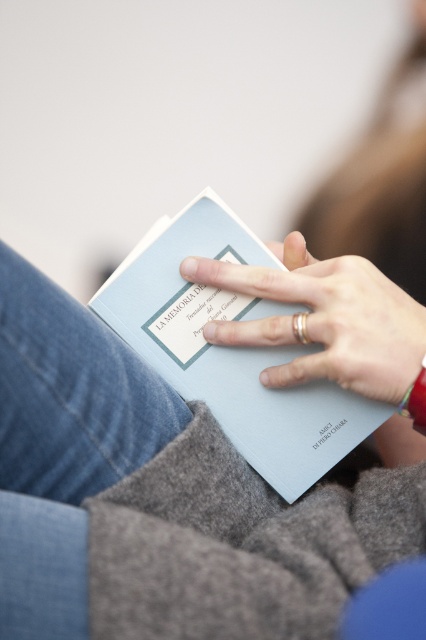
You are a photographer trying to capture the book cover clearly. Since the light blue matte paper at center and the smooth skin hand at center are in focus, which object should you adjust to ensure the book cover remains sharp when moving the camera slightly?

The light blue matte paper at center is larger in size than the smooth skin hand at center, so adjusting the light blue matte paper at center would be more effective to keep the book cover sharp as it has a larger surface area to work with.

You are a photographer adjusting the focus of your camera. You have two points to focus on in the image, point (109, 317) and point (310, 301). Which point is closer to the camera?

Point (310, 301) is closer to the camera than point (109, 317) because the description states that point (109, 317) is behind point (310, 301).